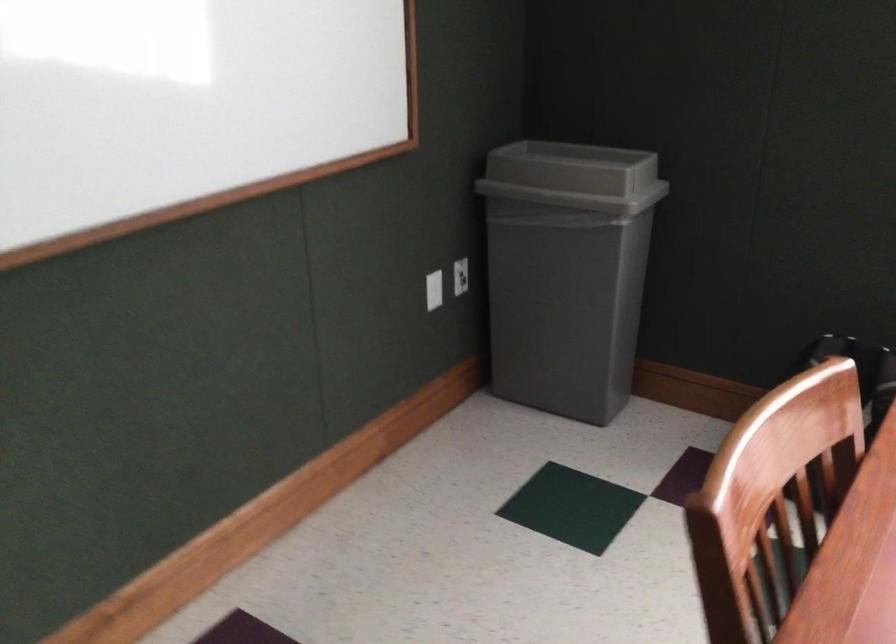
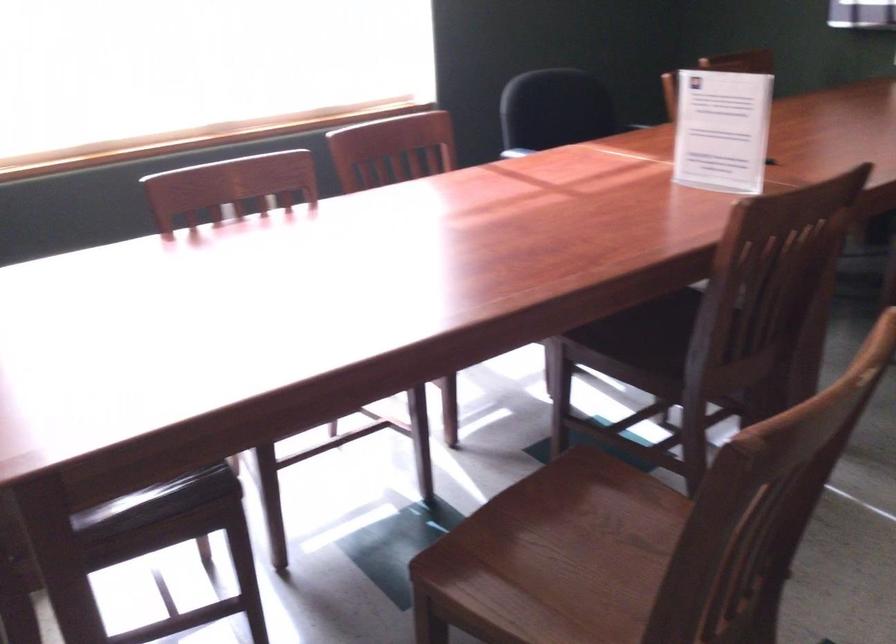
Question: The images are taken continuously from a first-person perspective. In which direction is your viewpoint rotating?

Choices:
 (A) Left
 (B) Right
 (C) Up
 (D) Down

Answer: (B)